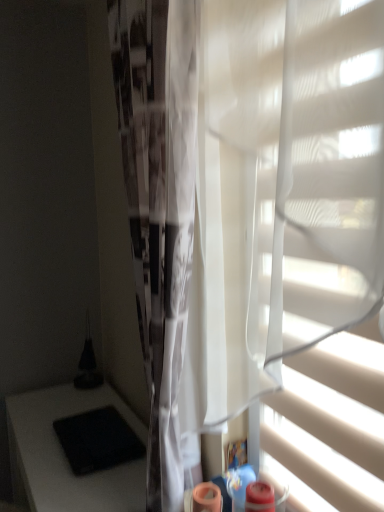
Where is `blank space to the left of black matte pad at lower left`? This screenshot has height=512, width=384. blank space to the left of black matte pad at lower left is located at coordinates (34, 438).